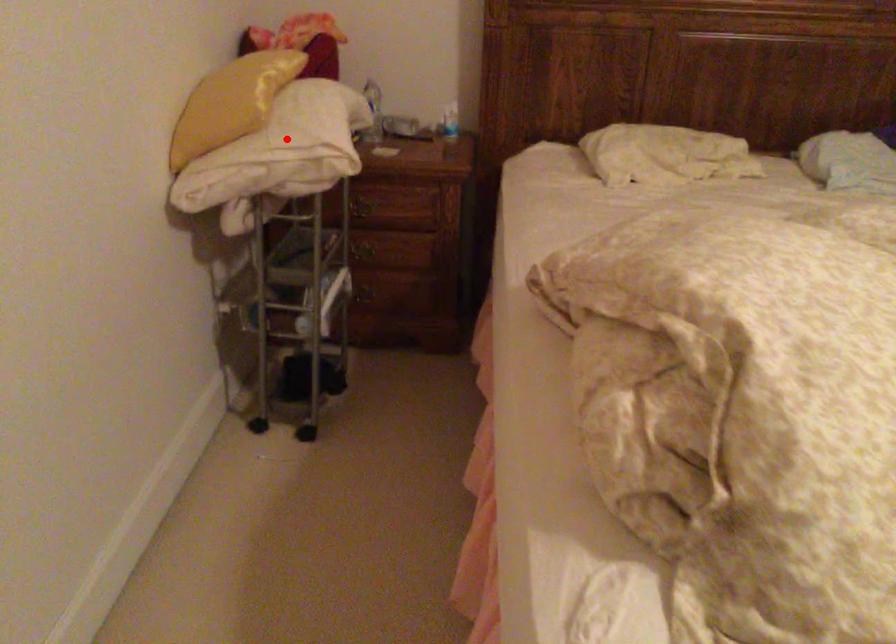
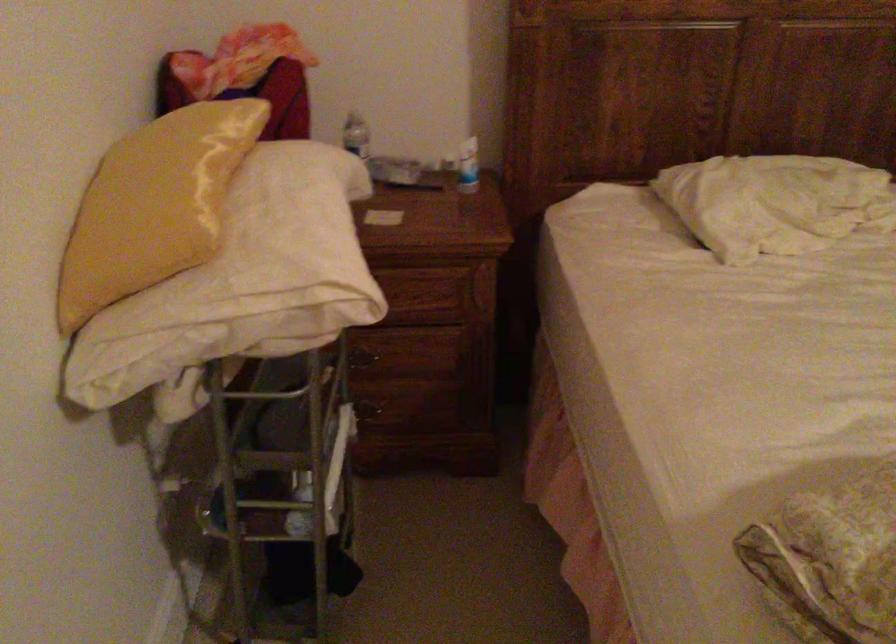
Find the pixel in the second image that matches the highlighted location in the first image.

(254, 272)